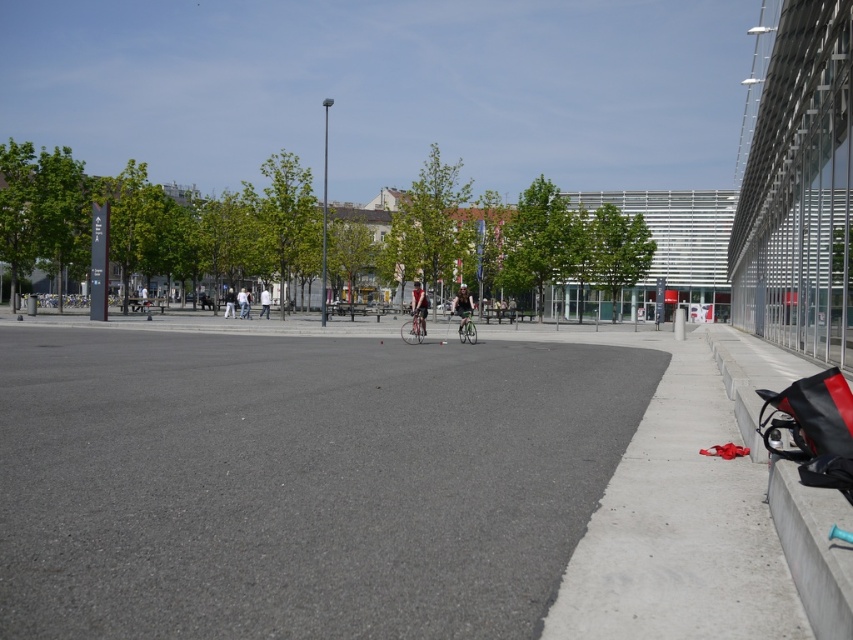
Question: Can you confirm if matte black bicycle at center is thinner than light blue jeans at center?

Choices:
 (A) yes
 (B) no

Answer: (A)

Question: Does green fabric jacket at center appear over white fabric bag at center?

Choices:
 (A) yes
 (B) no

Answer: (B)

Question: Does light blue jeans at center have a smaller size compared to white fabric jacket at center?

Choices:
 (A) no
 (B) yes

Answer: (B)

Question: Which of the following is the farthest from the observer?

Choices:
 (A) (546, 435)
 (B) (270, 298)
 (C) (474, 340)

Answer: (B)

Question: Which object appears farthest from the camera in this image?

Choices:
 (A) white fabric jacket at center
 (B) green fabric jacket at center
 (C) light blue jeans at center

Answer: (C)

Question: Which point is closer to the camera taking this photo?

Choices:
 (A) (262, 298)
 (B) (228, 305)
 (C) (242, 292)

Answer: (A)